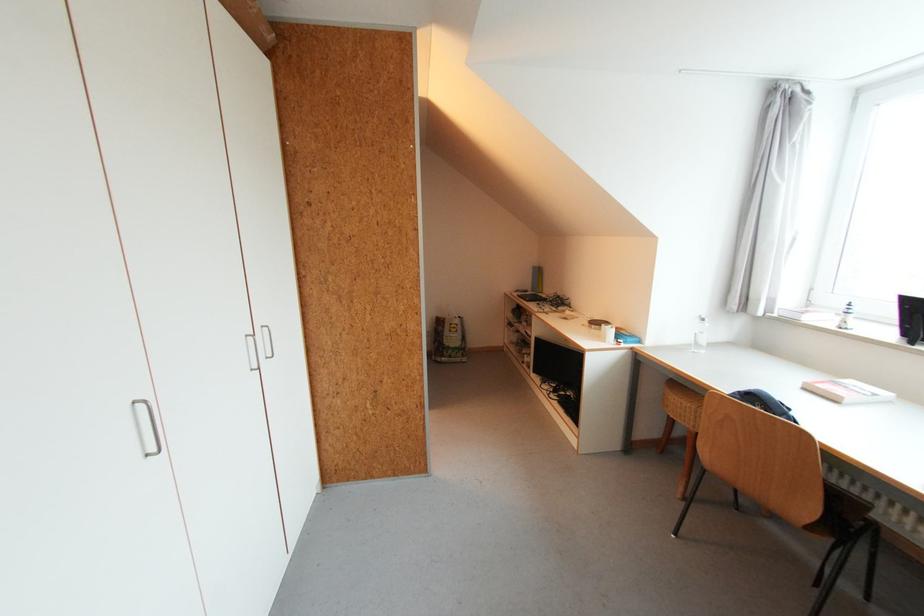
At what (x,y) coordinates should I click in order to perform the action: click on shopping bag handle. Please return your answer as a coordinate pair (x, y). Image resolution: width=924 pixels, height=616 pixels. Looking at the image, I should click on (447, 310).